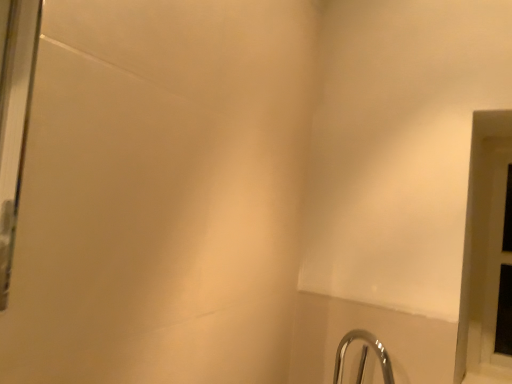
What do you see at coordinates (484, 249) in the screenshot? I see `white plastic window frame at right` at bounding box center [484, 249].

Where is `white plastic window frame at right`? The image size is (512, 384). white plastic window frame at right is located at coordinates (484, 249).

Where is `white plastic window frame at right`? white plastic window frame at right is located at coordinates (484, 249).